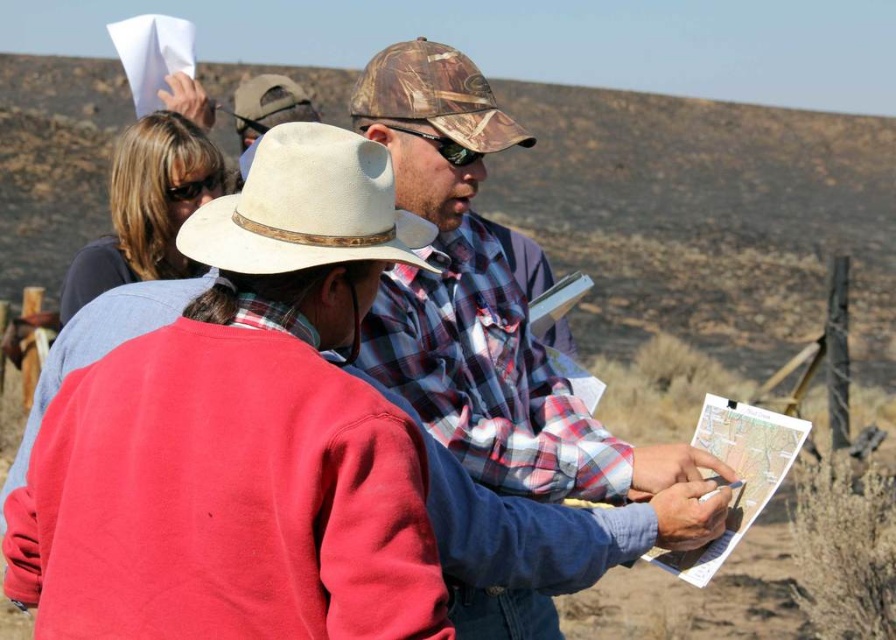
Can you confirm if white felt cowboy hat at center is positioned below camouflage fabric cowboy hat at center?

Yes.

Is point (257, 221) behind point (444, 156)?

No, it is in front of (444, 156).

Locate an element on the screen. The image size is (896, 640). white felt cowboy hat at center is located at coordinates (307, 208).

The width and height of the screenshot is (896, 640). Find the location of `plaid flannel shirt at center`. plaid flannel shirt at center is located at coordinates (480, 301).

Looking at this image, does plaid flannel shirt at center appear on the left side of white paper map at center?

Indeed, plaid flannel shirt at center is positioned on the left side of white paper map at center.

What are the coordinates of `plaid flannel shirt at center` in the screenshot? It's located at 480,301.

This screenshot has height=640, width=896. In order to click on plaid flannel shirt at center in this screenshot , I will do `click(480, 301)`.

Which is below, white felt cowboy hat at center or white paper map at center?

white paper map at center is below.

Between point (349, 172) and point (767, 492), which one is positioned behind?

The point (767, 492) is behind.

Who is more distant from viewer, (205, 241) or (717, 417)?

The point (717, 417) is behind.

Locate an element on the screen. white felt cowboy hat at center is located at coordinates (307, 208).